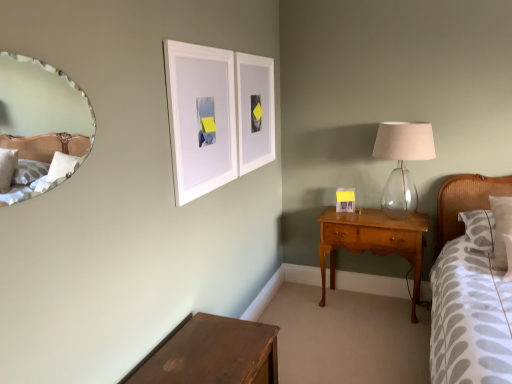
In order to click on unoccupied area in front of matte white picture frame at right, which ranks as the 3th picture frame in front-to-back order in this screenshot , I will do `click(356, 218)`.